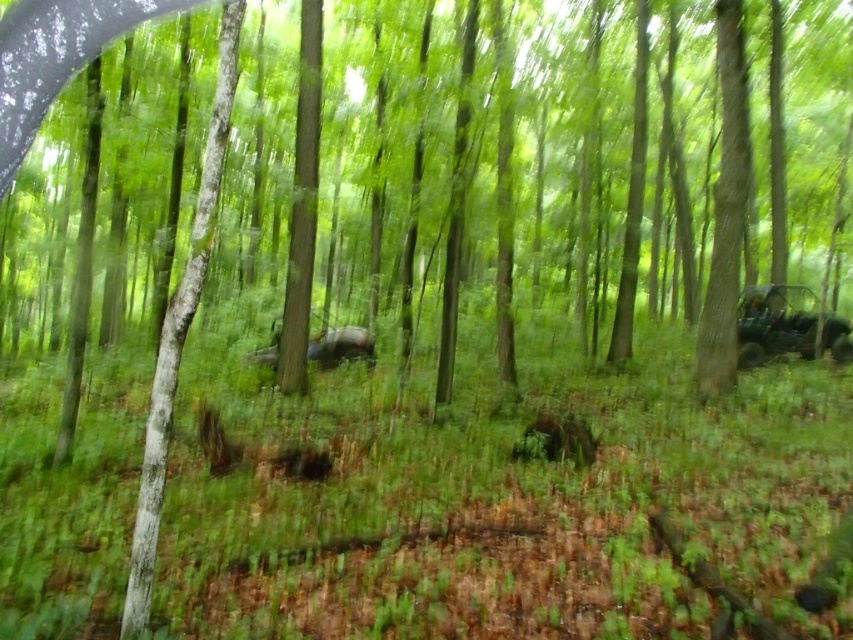
Question: Does green matte jeep at right appear over green matte car at center?

Choices:
 (A) yes
 (B) no

Answer: (A)

Question: Which point is closer to the camera?

Choices:
 (A) green matte jeep at right
 (B) green matte car at center

Answer: (A)

Question: Considering the relative positions of green matte jeep at right and green matte car at center in the image provided, where is green matte jeep at right located with respect to green matte car at center?

Choices:
 (A) left
 (B) right

Answer: (B)

Question: Which object appears farthest from the camera in this image?

Choices:
 (A) green matte car at center
 (B) green matte jeep at right

Answer: (A)

Question: Is green matte jeep at right wider than green matte car at center?

Choices:
 (A) no
 (B) yes

Answer: (B)